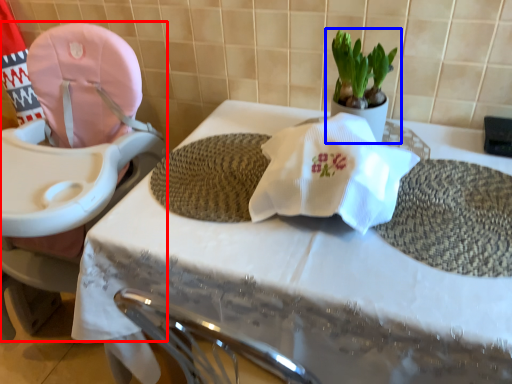
Question: Which object appears farthest to the camera in this image, baby carriage (highlighted by a red box) or houseplant (highlighted by a blue box)?

Choices:
 (A) baby carriage
 (B) houseplant

Answer: (B)